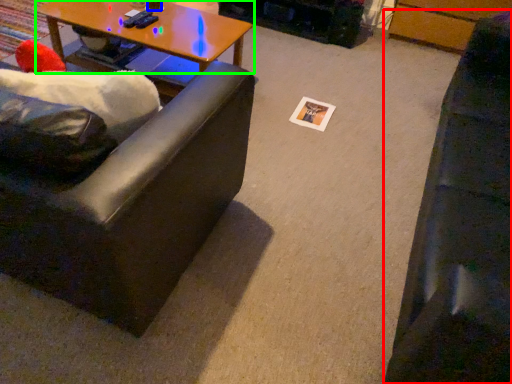
Question: Which is farther away from studio couch (highlighted by a red box)? coffee cup (highlighted by a blue box) or coffee table (highlighted by a green box)?

Choices:
 (A) coffee cup
 (B) coffee table

Answer: (A)